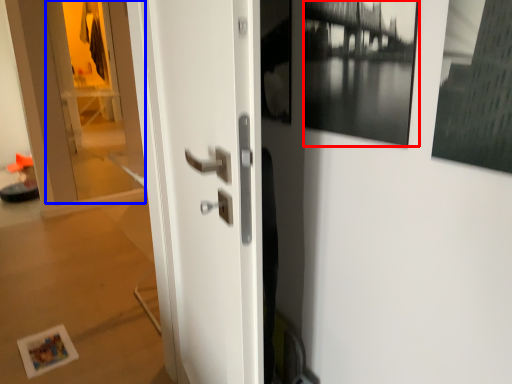
Question: Which point is further to the camera, picture frame (highlighted by a red box) or glass door (highlighted by a blue box)?

Choices:
 (A) picture frame
 (B) glass door

Answer: (B)